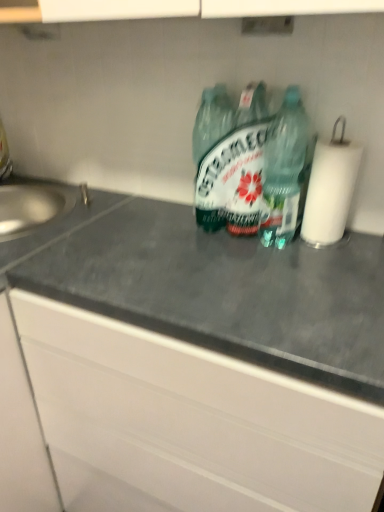
Image resolution: width=384 pixels, height=512 pixels. Find the location of `free spot to the right of white paper at right`. free spot to the right of white paper at right is located at coordinates (365, 237).